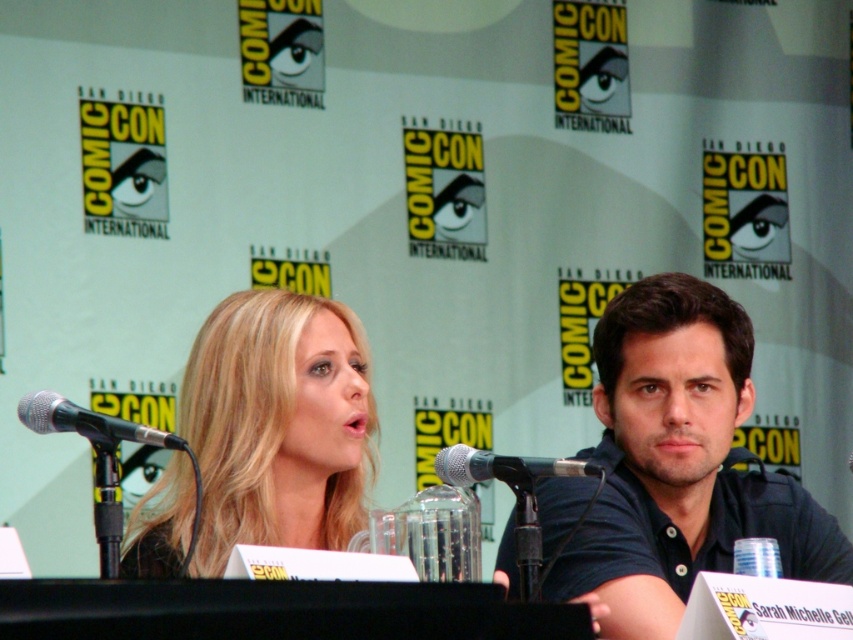
Which of these two, dark blue polo shirt at center or blonde hair at center, stands shorter?

Standing shorter between the two is blonde hair at center.

Between dark blue polo shirt at center and blonde hair at center, which one appears on the right side from the viewer's perspective?

dark blue polo shirt at center

Between point (608, 353) and point (299, 522), which one is positioned behind?

Positioned behind is point (608, 353).

The height and width of the screenshot is (640, 853). In order to click on dark blue polo shirt at center in this screenshot , I will do `click(680, 464)`.

Is point (216, 492) in front of point (482, 465)?

No, (216, 492) is further to viewer.

Identify the location of blonde hair at center. (277, 424).

Between silver metallic microphone at left and black metallic microphone at center, which one appears on the right side from the viewer's perspective?

From the viewer's perspective, black metallic microphone at center appears more on the right side.

Consider the image. Does silver metallic microphone at left have a lesser height compared to black metallic microphone at center?

Incorrect, silver metallic microphone at left's height does not fall short of black metallic microphone at center's.

Between point (136, 440) and point (457, 477), which one is positioned behind?

Positioned behind is point (457, 477).

You are a GUI agent. You are given a task and a screenshot of the screen. Output one action in this format:
    pyautogui.click(x=<x>, y=<y>)
    Task: Click on the silver metallic microphone at left
    This screenshot has width=853, height=640.
    Given the screenshot: What is the action you would take?
    pyautogui.click(x=88, y=422)